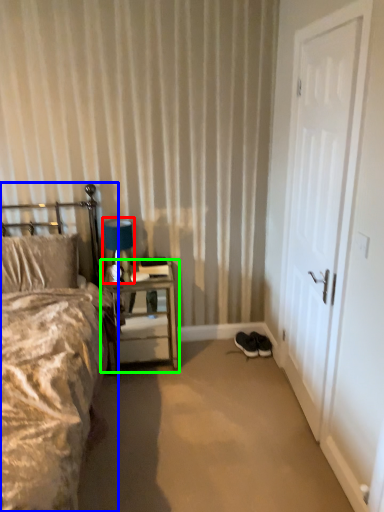
Question: Based on their relative distances, which object is farther from table lamp (highlighted by a red box)? Choose from bed (highlighted by a blue box) and nightstand (highlighted by a green box).

Choices:
 (A) bed
 (B) nightstand

Answer: (A)